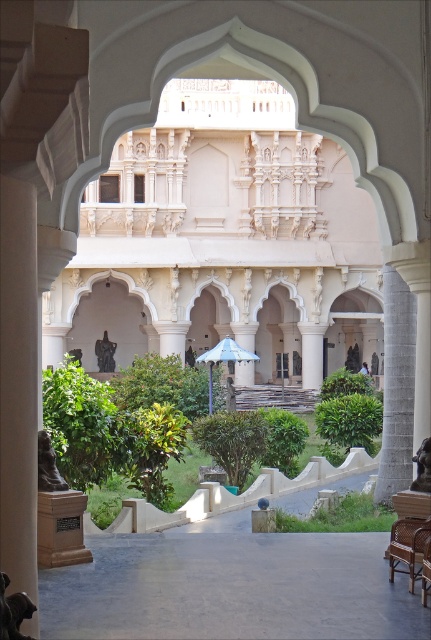
You are planning to place a large potted plant between the brown woven chair at lower right and the blue fabric umbrella at center. Considering their sizes, which object should the plant be placed closer to?

The plant should be placed closer to the blue fabric umbrella at center since the brown woven chair at lower right is smaller in size, meaning the umbrella is larger and can accommodate the plant better.

You are standing in the courtyard and want to move from the white marble pillar at left to the brown woven chair at lower right. Which direction should you move?

You should move to the right to reach the brown woven chair at lower right from the white marble pillar at left.